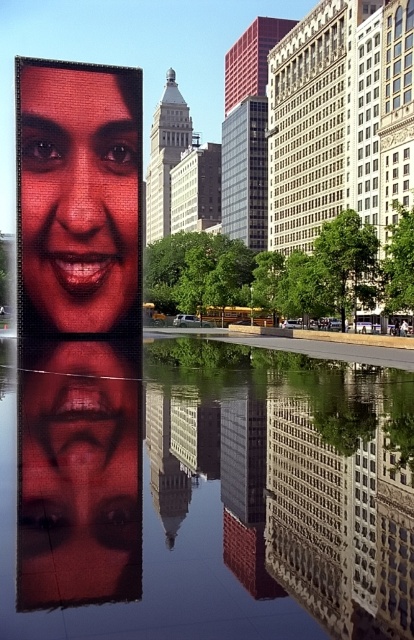
Who is positioned more to the right, glossy reflective water at center or matte black face at center?

glossy reflective water at center

Does glossy reflective water at center have a smaller size compared to matte black face at center?

Incorrect, glossy reflective water at center is not smaller in size than matte black face at center.

What do you see at coordinates (201, 504) in the screenshot?
I see `glossy reflective water at center` at bounding box center [201, 504].

You are a GUI agent. You are given a task and a screenshot of the screen. Output one action in this format:
    pyautogui.click(x=<x>, y=<y>)
    Task: Click on the glossy reflective water at center
    
    Given the screenshot: What is the action you would take?
    tap(201, 504)

Find the location of a particular element. The image size is (414, 640). matte red face at upper left is located at coordinates (79, 198).

Which is behind, point (76, 74) or point (89, 436)?

The point (76, 74) is more distant.

The image size is (414, 640). Identify the location of matte red face at upper left. [79, 198].

Which is more to the right, glossy reflective water at center or matte red face at upper left?

Positioned to the right is glossy reflective water at center.

Is point (96, 616) positioned after point (21, 77)?

No.

Image resolution: width=414 pixels, height=640 pixels. Identify the location of glossy reflective water at center. (201, 504).